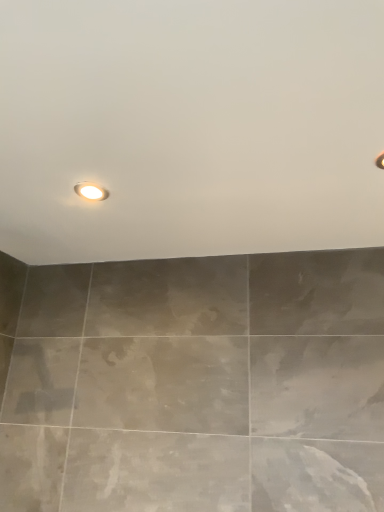
Identify the location of matte white droplight at upper left. Image resolution: width=384 pixels, height=512 pixels. pyautogui.click(x=91, y=191).

What do you see at coordinates (91, 191) in the screenshot? I see `matte white droplight at upper left` at bounding box center [91, 191].

In order to click on matte white droplight at upper left in this screenshot , I will do `click(91, 191)`.